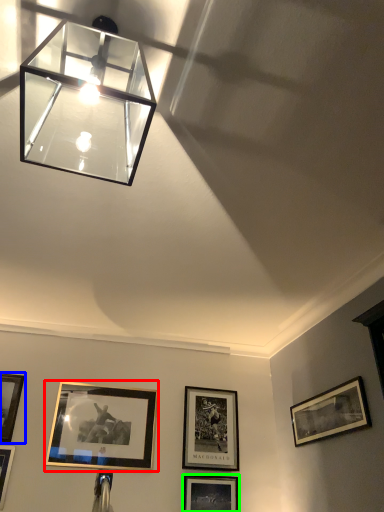
Question: Which is nearer to the picture frame (highlighted by a red box)? picture frame (highlighted by a blue box) or picture frame (highlighted by a green box).

Choices:
 (A) picture frame
 (B) picture frame

Answer: (A)